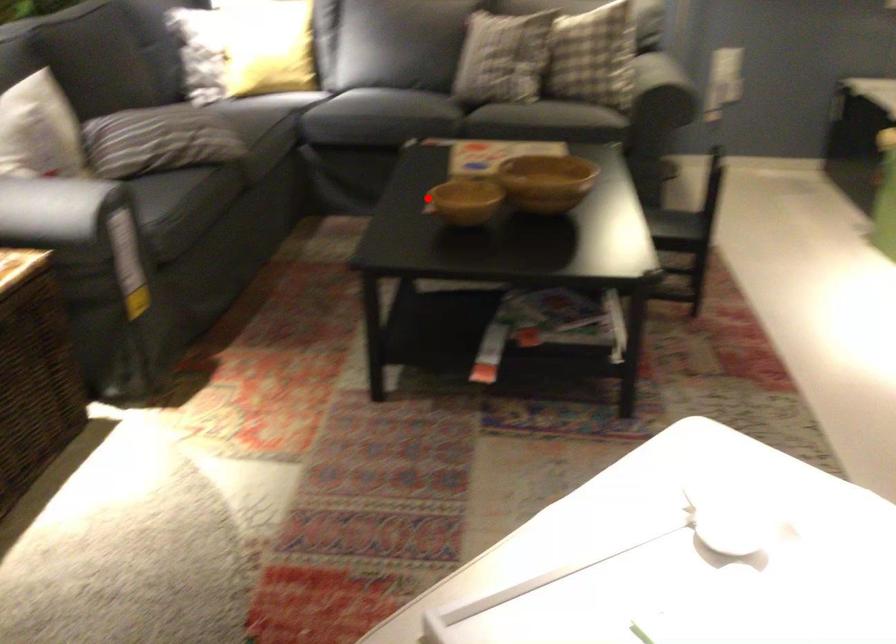
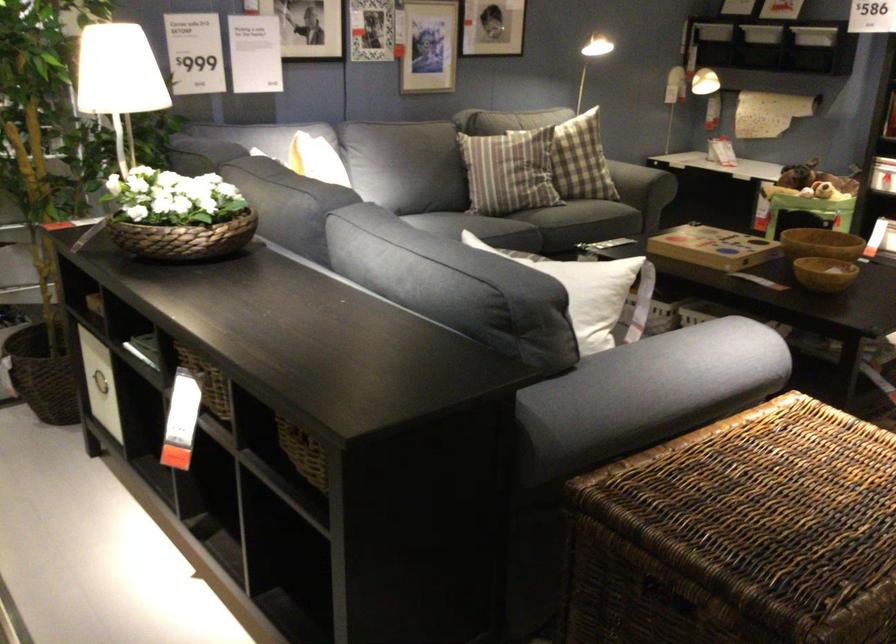
Where in the second image is the point corresponding to the highlighted location from the first image?

(823, 272)